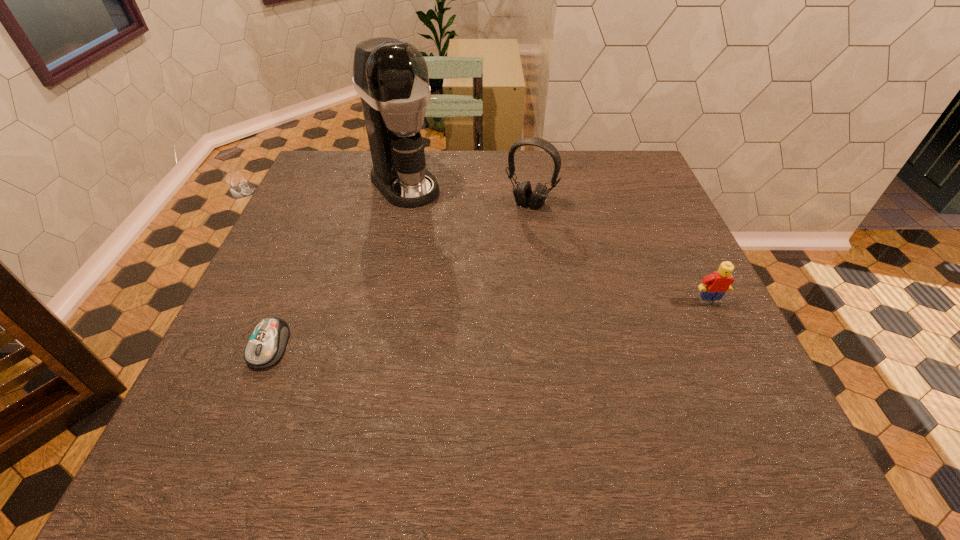
Locate an element on the screen. This screenshot has width=960, height=540. vacant spot on the desktop that is between the nearest object and the rightmost object and is positioned on the front-facing side of the headset is located at coordinates (459, 327).

Image resolution: width=960 pixels, height=540 pixels. In order to click on free space on the desktop that is between the nearest object and the rightmost object and is positioned place cup under the spout of the coffee maker in this screenshot , I will do `click(534, 319)`.